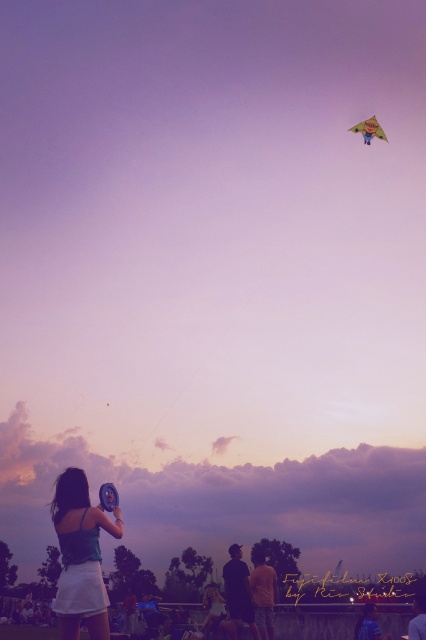
You are a photographer trying to capture the matte teal tank top at lower left and the yellow fabric kite at upper center in a single frame. Can you focus on both objects clearly at the same time?

The matte teal tank top at lower left is in front of the yellow fabric kite at upper center, so focusing on both clearly at the same time may be challenging due to their different distances from the camera.

You are a photographer trying to capture the scene with the matte teal tank top at lower left and the yellow fabric kite at upper center. Which object is closer to the camera based on their sizes?

The matte teal tank top at lower left is shorter than the yellow fabric kite at upper center, so the yellow fabric kite at upper center is farther away from the camera, meaning the matte teal tank top at lower left is closer to the camera.

You are a photographer trying to capture the scene with a camera that has a limited field of view. You want to include both the matte teal tank top at lower left and the yellow fabric kite at upper center in the same frame. Based on their sizes in the image, which object should you focus on to ensure both are visible without cropping?

Since the matte teal tank top at lower left occupies less space than the yellow fabric kite at upper center, you should focus on the yellow fabric kite at upper center to ensure both objects fit within the frame.